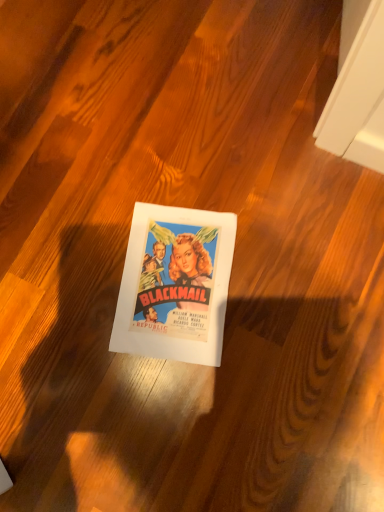
Where is `vacant area located to the right-hand side of white paper poster at center`? The width and height of the screenshot is (384, 512). vacant area located to the right-hand side of white paper poster at center is located at coordinates (294, 259).